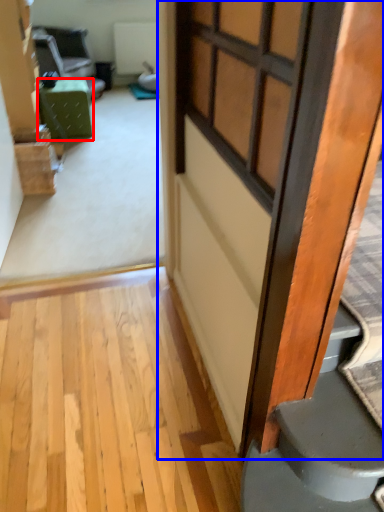
Question: Which object appears closest to the camera in this image, furniture (highlighted by a red box) or door (highlighted by a blue box)?

Choices:
 (A) furniture
 (B) door

Answer: (B)